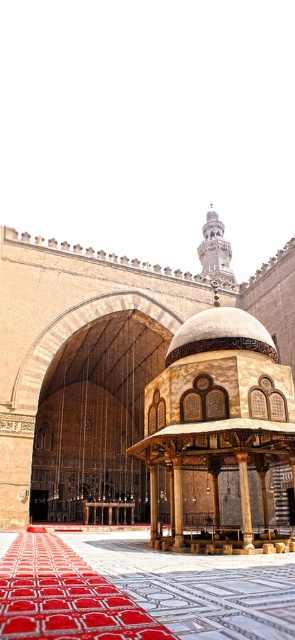
Question: Observing the image, what is the correct spatial positioning of gold textured dome at center in reference to polished stone column at center?

Choices:
 (A) left
 (B) right

Answer: (A)

Question: Which of the following is the closest to the observer?

Choices:
 (A) brown polished wood pillar at center
 (B) gold textured dome at center

Answer: (A)

Question: Is polished stone column at center thinner than brown polished wood pillar at center?

Choices:
 (A) yes
 (B) no

Answer: (B)

Question: Can you confirm if red carpet at center is positioned to the left of gold textured dome at center?

Choices:
 (A) yes
 (B) no

Answer: (A)

Question: Which point is farther from the camera taking this photo?

Choices:
 (A) (176, 500)
 (B) (74, 568)

Answer: (A)

Question: Which point appears closest to the camera in this image?

Choices:
 (A) (177, 468)
 (B) (154, 513)

Answer: (A)